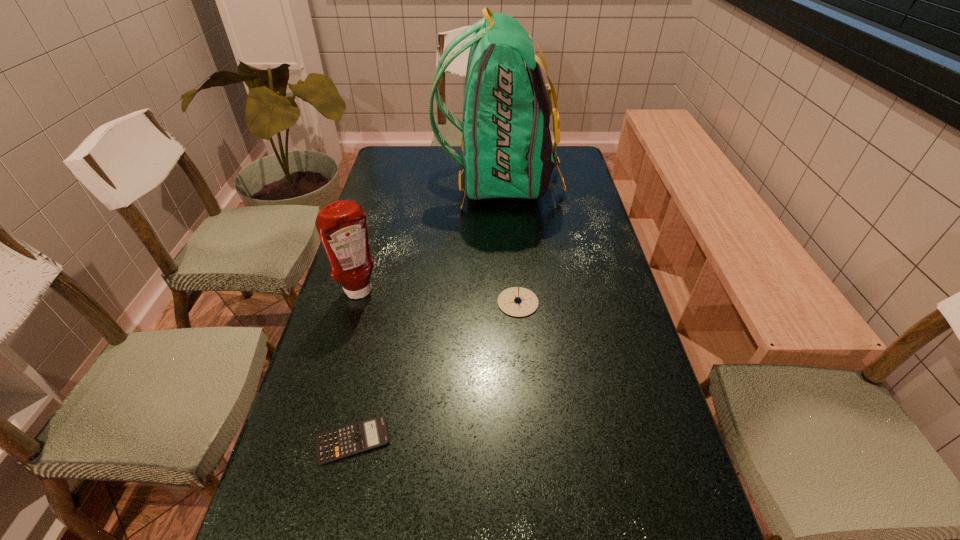
Where is `backpack`? The width and height of the screenshot is (960, 540). backpack is located at coordinates (507, 148).

Where is `the tallest object`? The width and height of the screenshot is (960, 540). the tallest object is located at coordinates (507, 148).

The image size is (960, 540). In order to click on the third shortest object in this screenshot , I will do `click(341, 225)`.

At what (x,y) coordinates should I click in order to perform the action: click on the third tallest object. Please return your answer as a coordinate pair (x, y). This screenshot has width=960, height=540. Looking at the image, I should click on (516, 301).

This screenshot has width=960, height=540. Find the location of `calculator`. calculator is located at coordinates (339, 443).

Identify the location of the nearest object. (339, 443).

I want to click on vacant area situated on the back of the backpack, so click(420, 181).

Locate an element on the screen. Image resolution: width=960 pixels, height=540 pixels. vacant space located on the back of the backpack is located at coordinates (420, 181).

The width and height of the screenshot is (960, 540). I want to click on free location located on the back of the backpack, so click(x=414, y=181).

The width and height of the screenshot is (960, 540). In order to click on vacant space located on the right of the condiment in this screenshot , I will do `click(514, 292)`.